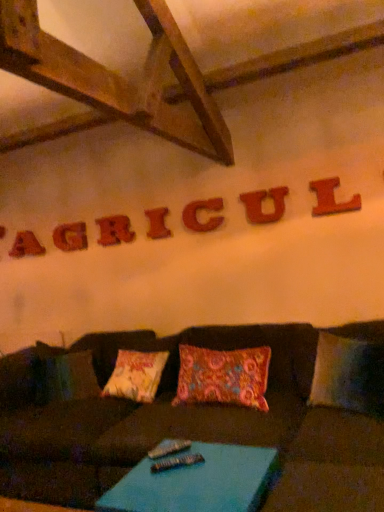
Question: Is brown fabric couch at center outside matte wooden letter at upper center, which is counted as the 2th letter, starting from the left?

Choices:
 (A) no
 (B) yes

Answer: (B)

Question: Is matte wooden letter at upper center, which is counted as the 2th letter, starting from the left, at the back of brown fabric couch at center?

Choices:
 (A) yes
 (B) no

Answer: (B)

Question: From a real-world perspective, is brown fabric couch at center over matte wooden letter at upper center, which is counted as the 2th letter, starting from the left?

Choices:
 (A) yes
 (B) no

Answer: (B)

Question: Does brown fabric couch at center turn towards matte wooden letter at upper center, which is counted as the 2th letter, starting from the left?

Choices:
 (A) no
 (B) yes

Answer: (A)

Question: From the image's perspective, is brown fabric couch at center under matte wooden letter at upper center, arranged as the sixth letter when viewed from the right?

Choices:
 (A) yes
 (B) no

Answer: (A)

Question: Is brown fabric couch at center surrounding matte wooden letter at upper center, placed as the second letter when sorted from back to front?

Choices:
 (A) yes
 (B) no

Answer: (B)

Question: Is blue fabric table at lower center completely or partially inside wooden letter i at center, the 4th letter viewed from the left?

Choices:
 (A) no
 (B) yes

Answer: (A)

Question: Does wooden letter i at center, the 4th letter viewed from the left, have a greater height compared to blue fabric table at lower center?

Choices:
 (A) no
 (B) yes

Answer: (A)

Question: Is wooden letter i at center, marked as the 4th letter in a right-to-left arrangement, at the left side of blue fabric table at lower center?

Choices:
 (A) no
 (B) yes

Answer: (B)

Question: Can we say wooden letter i at center, marked as the fourth letter in a front-to-back arrangement, lies outside blue fabric table at lower center?

Choices:
 (A) yes
 (B) no

Answer: (A)

Question: Does wooden letter i at center, marked as the fourth letter in a front-to-back arrangement, have a smaller size compared to blue fabric table at lower center?

Choices:
 (A) yes
 (B) no

Answer: (A)

Question: From the image's perspective, would you say wooden letter i at center, the fourth letter when ordered from back to front, is shown under blue fabric table at lower center?

Choices:
 (A) yes
 (B) no

Answer: (B)

Question: Does metallic silver remote at center have a lesser height compared to wooden letter l at upper right, positioned as the 1th letter in right-to-left order?

Choices:
 (A) no
 (B) yes

Answer: (B)